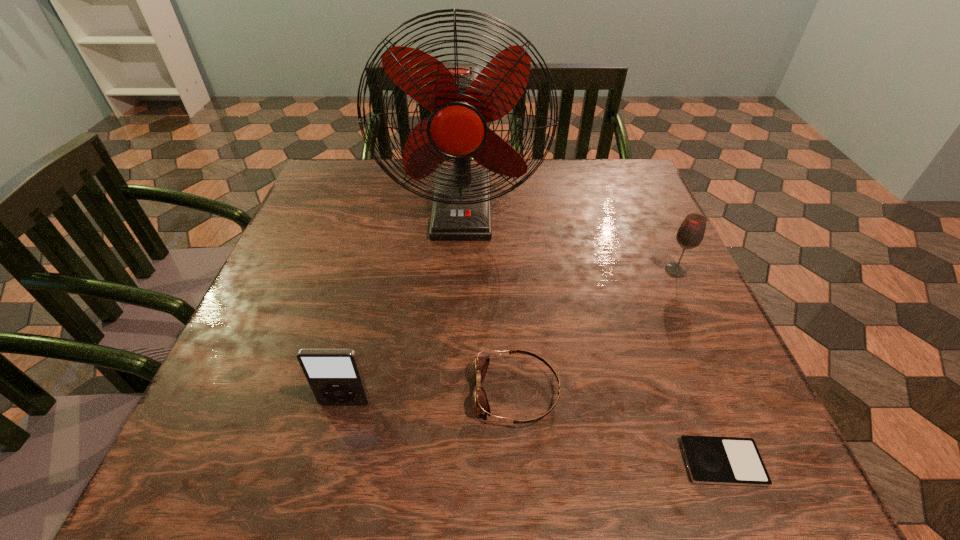
Where is `the tallest object`? The width and height of the screenshot is (960, 540). the tallest object is located at coordinates (462, 99).

Where is `fan`? This screenshot has width=960, height=540. fan is located at coordinates (462, 99).

What are the coordinates of `the left iPod` in the screenshot? It's located at (334, 375).

At what (x,y) coordinates should I click in order to perform the action: click on the taller iPod. Please return your answer as a coordinate pair (x, y). The image size is (960, 540). Looking at the image, I should click on (334, 375).

At what (x,y) coordinates should I click in order to perform the action: click on glass drink container. Please return your answer as a coordinate pair (x, y). Looking at the image, I should click on tap(690, 234).

The width and height of the screenshot is (960, 540). What are the coordinates of `the second shortest object` in the screenshot? It's located at (481, 405).

The width and height of the screenshot is (960, 540). In order to click on the nearer iPod in this screenshot , I will do `click(710, 460)`.

Find the location of a particular element. This screenshot has height=540, width=960. the nearest object is located at coordinates (710, 460).

In order to click on vacant area situated 0.110m on the front-facing side of the farthest object in this screenshot , I will do `click(459, 275)`.

Find the location of a particular element. This screenshot has height=540, width=960. free space located 0.090m on the front-facing side of the taller iPod is located at coordinates (330, 464).